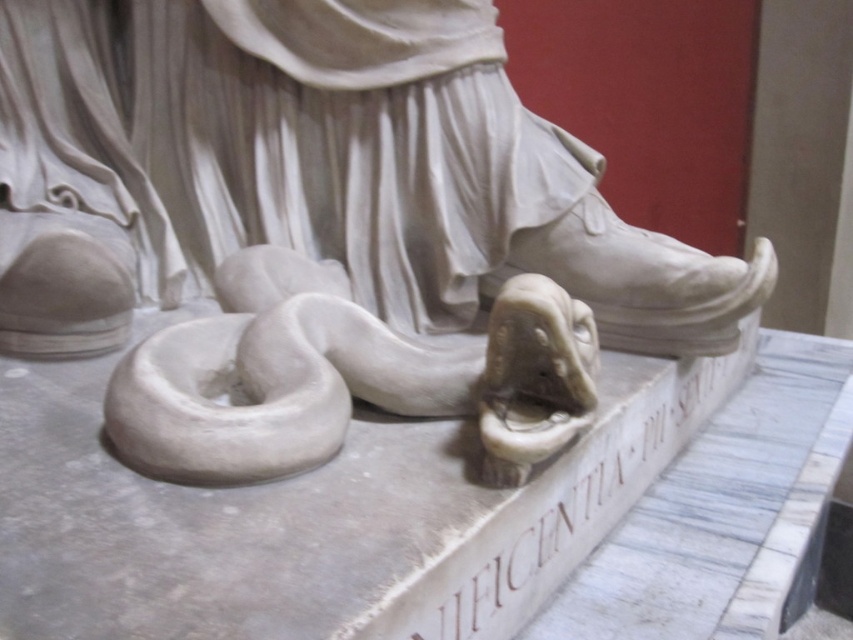
You are an art conservator examining the sculpture. You notice two points of concern on the sculpture. The first point is at coordinate point (x=233, y=189) and the second is at point (x=538, y=337). Which point is closer to you, the conservator?

Point (x=233, y=189) is closer to you than point (x=538, y=337).

You are an art conservator examining the sculpture. You notice the white marble snake at lower left and the white matte bagel at lower left. Which object is positioned higher on the sculpture?

The white marble snake at lower left is above the white matte bagel at lower left, so it is positioned higher on the sculpture.